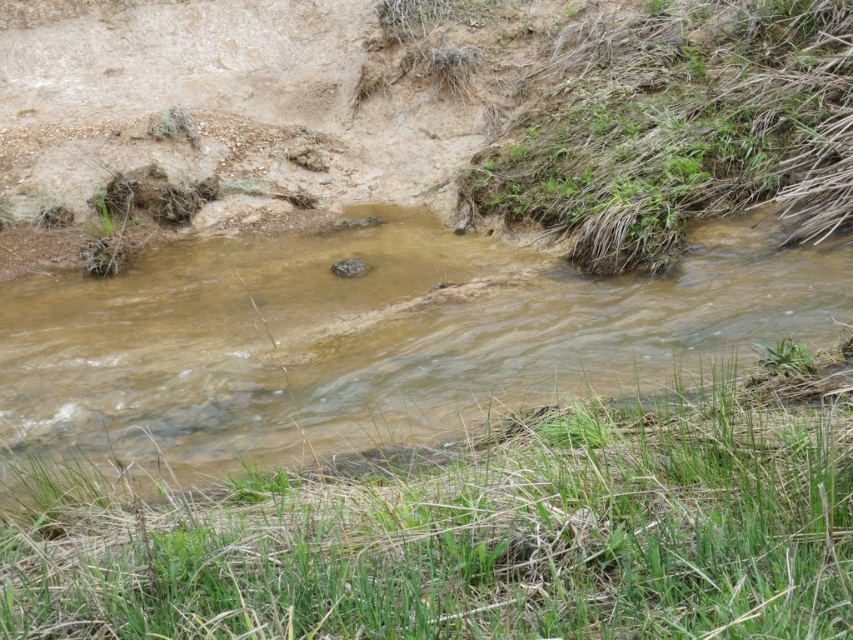
Question: Which of the following is the farthest from the observer?

Choices:
 (A) (268, 397)
 (B) (813, 426)

Answer: (A)

Question: Does green grass at lower center appear on the right side of brown muddy water at center?

Choices:
 (A) yes
 (B) no

Answer: (B)

Question: From the image, what is the correct spatial relationship of green grass at lower center in relation to brown muddy water at center?

Choices:
 (A) right
 (B) left

Answer: (B)

Question: Can you confirm if green grass at lower center is positioned to the left of brown muddy water at center?

Choices:
 (A) yes
 (B) no

Answer: (A)

Question: Which object appears farthest from the camera in this image?

Choices:
 (A) brown muddy water at center
 (B) green grass at lower center

Answer: (A)

Question: Which point is farther from the camera taking this photo?

Choices:
 (A) (646, 474)
 (B) (676, 324)

Answer: (B)